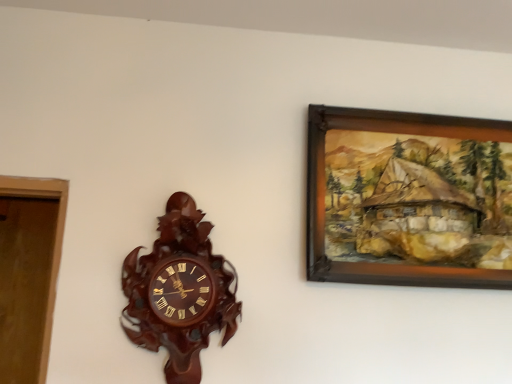
The image size is (512, 384). Describe the element at coordinates (408, 199) in the screenshot. I see `wooden picture frame at upper right` at that location.

At what (x,y) coordinates should I click in order to perform the action: click on wooden picture frame at upper right. Please return your answer as a coordinate pair (x, y). Looking at the image, I should click on (408, 199).

Locate an element on the screen. Image resolution: width=512 pixels, height=384 pixels. wooden carved clock at center-left is located at coordinates (179, 291).

What do you see at coordinates (179, 291) in the screenshot? I see `wooden carved clock at center-left` at bounding box center [179, 291].

The image size is (512, 384). What are the coordinates of `wooden picture frame at upper right` in the screenshot? It's located at tap(408, 199).

Considering the positions of objects wooden picture frame at upper right and wooden carved clock at center-left in the image provided, who is more to the right, wooden picture frame at upper right or wooden carved clock at center-left?

From the viewer's perspective, wooden picture frame at upper right appears more on the right side.

Which object is more forward, wooden picture frame at upper right or wooden carved clock at center-left?

wooden carved clock at center-left is more forward.

Is point (485, 123) in front of point (229, 264)?

No, (485, 123) is behind (229, 264).

From the image's perspective, between wooden picture frame at upper right and wooden carved clock at center-left, which one is located above?

From the image's view, wooden picture frame at upper right is above.

From a real-world perspective, which object stands above the other?

In real-world perspective, wooden picture frame at upper right is above.

In terms of width, does wooden picture frame at upper right look wider or thinner when compared to wooden carved clock at center-left?

Considering their sizes, wooden picture frame at upper right looks slimmer than wooden carved clock at center-left.

Does wooden picture frame at upper right have a lesser height compared to wooden carved clock at center-left?

Correct, wooden picture frame at upper right is not as tall as wooden carved clock at center-left.

Considering the sizes of objects wooden picture frame at upper right and wooden carved clock at center-left in the image provided, who is bigger, wooden picture frame at upper right or wooden carved clock at center-left?

With larger size is wooden picture frame at upper right.

Is wooden picture frame at upper right spatially inside wooden carved clock at center-left, or outside of it?

wooden picture frame at upper right is spatially situated outside wooden carved clock at center-left.

Is wooden picture frame at upper right directly adjacent to wooden carved clock at center-left?

wooden picture frame at upper right is not next to wooden carved clock at center-left, and they're not touching.

Is wooden carved clock at center-left at the back of wooden picture frame at upper right?

wooden picture frame at upper right does not have its back to wooden carved clock at center-left.

Identify the location of picture frame that is behind the wooden carved clock at center-left. (408, 199).

Which object is positioned more to the left, wooden carved clock at center-left or wooden picture frame at upper right?

wooden carved clock at center-left is more to the left.

Is the depth of wooden carved clock at center-left less than that of wooden picture frame at upper right?

Yes, it is in front of wooden picture frame at upper right.

Which is nearer, (168, 314) or (489, 143)?

Point (168, 314) is positioned closer to the camera compared to point (489, 143).

Based on the photo, from the image's perspective, is wooden carved clock at center-left located above or below wooden picture frame at upper right?

wooden carved clock at center-left is situated lower than wooden picture frame at upper right in the image.

In the scene shown: From a real-world perspective, who is located lower, wooden carved clock at center-left or wooden picture frame at upper right?

In real-world perspective, wooden carved clock at center-left is lower.

Considering the relative sizes of wooden carved clock at center-left and wooden picture frame at upper right in the image provided, is wooden carved clock at center-left wider than wooden picture frame at upper right?

Yes, wooden carved clock at center-left is wider than wooden picture frame at upper right.

Considering the relative sizes of wooden carved clock at center-left and wooden picture frame at upper right in the image provided, is wooden carved clock at center-left shorter than wooden picture frame at upper right?

No, wooden carved clock at center-left is not shorter than wooden picture frame at upper right.

Between wooden carved clock at center-left and wooden picture frame at upper right, which one has smaller size?

Smaller between the two is wooden carved clock at center-left.

Is wooden carved clock at center-left spatially inside wooden picture frame at upper right, or outside of it?

wooden carved clock at center-left lies outside wooden picture frame at upper right.

Is wooden carved clock at center-left in contact with wooden picture frame at upper right?

wooden carved clock at center-left and wooden picture frame at upper right are clearly separated.

Is wooden carved clock at center-left positioned with its back to wooden picture frame at upper right?

No, wooden carved clock at center-left is not facing the opposite direction of wooden picture frame at upper right.

Can you tell me how much wooden carved clock at center-left and wooden picture frame at upper right differ in facing direction?

The facing directions of wooden carved clock at center-left and wooden picture frame at upper right are 0.00302 degrees apart.

How distant is wooden carved clock at center-left from wooden picture frame at upper right?

wooden carved clock at center-left is 19.84 inches from wooden picture frame at upper right.

This screenshot has height=384, width=512. Find the location of `wall clock in front of the wooden picture frame at upper right`. wall clock in front of the wooden picture frame at upper right is located at coordinates (179, 291).

Find the location of a particular element. wall clock that appears in front of the wooden picture frame at upper right is located at coordinates (179, 291).

Image resolution: width=512 pixels, height=384 pixels. In order to click on wall clock below the wooden picture frame at upper right (from the image's perspective) in this screenshot , I will do `click(179, 291)`.